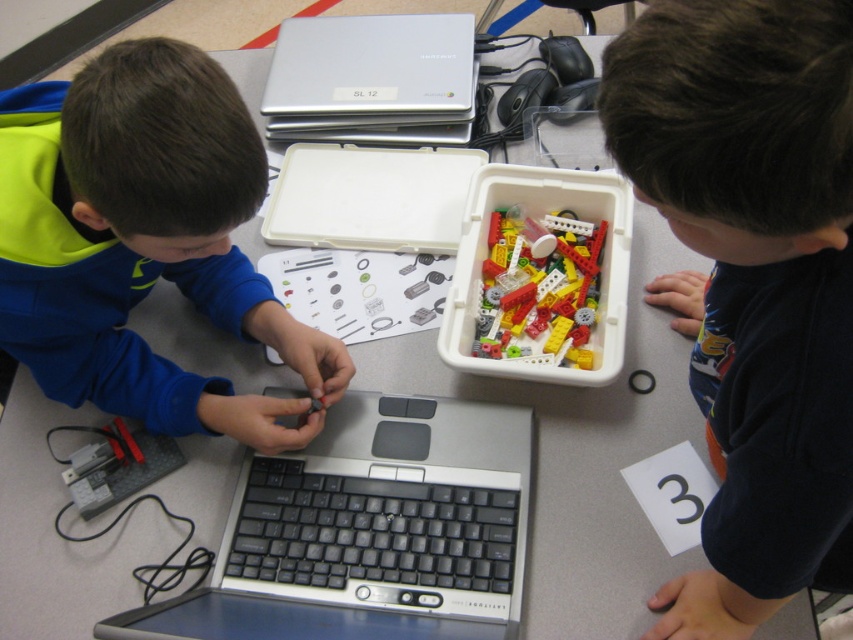
Does blue matte shirt at left appear on the right side of translucent plastic lego pieces at center?

In fact, blue matte shirt at left is to the left of translucent plastic lego pieces at center.

Is point (97, 360) positioned in front of point (554, 305)?

Yes, it is.

You are a GUI agent. You are given a task and a screenshot of the screen. Output one action in this format:
    pyautogui.click(x=<x>, y=<y>)
    Task: Click on the blue matte shirt at left
    The width and height of the screenshot is (853, 640).
    Given the screenshot: What is the action you would take?
    pos(143,241)

Where is `blue matte shirt at left`? Image resolution: width=853 pixels, height=640 pixels. blue matte shirt at left is located at coordinates (143, 241).

Does dark blue fabric at lower right come behind silver metallic laptop at upper center?

No, dark blue fabric at lower right is in front of silver metallic laptop at upper center.

Is point (815, 188) in front of point (291, 52)?

That is True.

Which is behind, point (685, 51) or point (315, 51)?

Positioned behind is point (315, 51).

Where is `dark blue fabric at lower right`? Image resolution: width=853 pixels, height=640 pixels. dark blue fabric at lower right is located at coordinates (751, 280).

Does point (351, 45) lie in front of point (500, 280)?

No, (351, 45) is behind (500, 280).

Based on the photo, who is more forward, (380, 74) or (497, 321)?

Positioned in front is point (497, 321).

I want to click on silver metallic laptop at upper center, so 370,65.